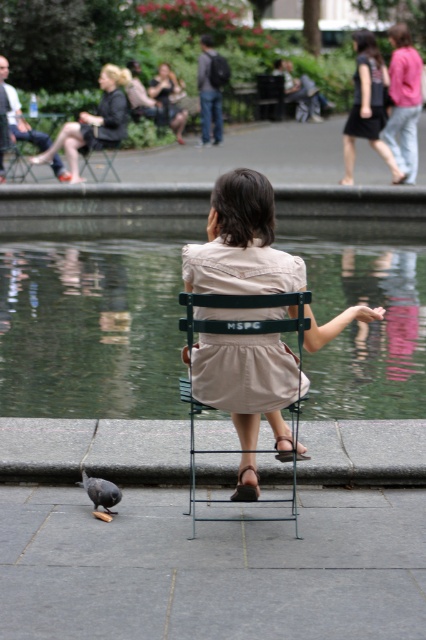
Question: Based on their relative distances, which object is farther from the matte beige dress at center?

Choices:
 (A) green reflective water at center
 (B) beige cotton dress at center
 (C) matte black jacket at upper left

Answer: (B)

Question: Does beige fabric dress at center have a larger size compared to gray matte pigeon at lower left?

Choices:
 (A) yes
 (B) no

Answer: (A)

Question: Is green reflective water at center positioned at the back of beige fabric dress at center?

Choices:
 (A) no
 (B) yes

Answer: (B)

Question: Which is farther from the beige fabric dress at center?

Choices:
 (A) metallic green chair at center
 (B) matte black jacket at upper left
 (C) green reflective water at center

Answer: (B)

Question: Is green reflective water at center in front of beige cotton dress at center?

Choices:
 (A) yes
 (B) no

Answer: (B)

Question: Estimate the real-world distances between objects in this image. Which object is farther from the beige cotton dress at center?

Choices:
 (A) black satin dress at upper right
 (B) dark brown dress at upper right

Answer: (A)